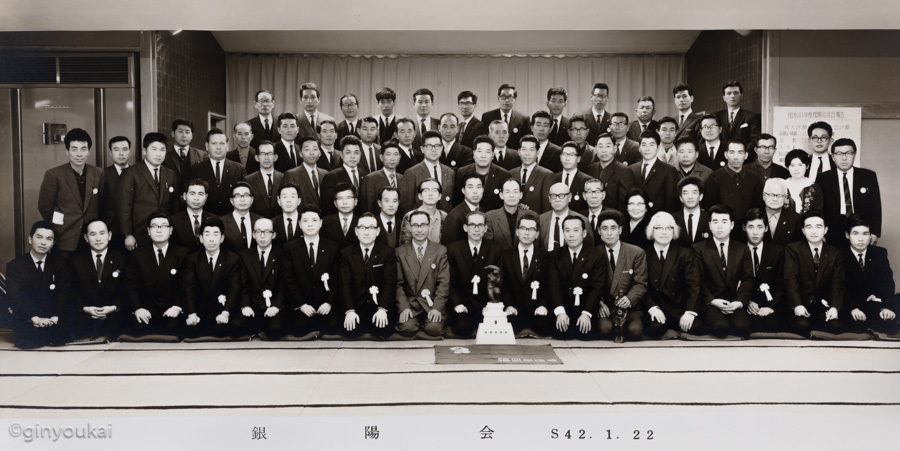
You are a GUI agent. You are given a task and a screenshot of the screen. Output one action in this format:
    pyautogui.click(x=<x>, y=<y>)
    Task: Click on the window
    This screenshot has width=900, height=451.
    Given the screenshot: What is the action you would take?
    pyautogui.click(x=54, y=132)